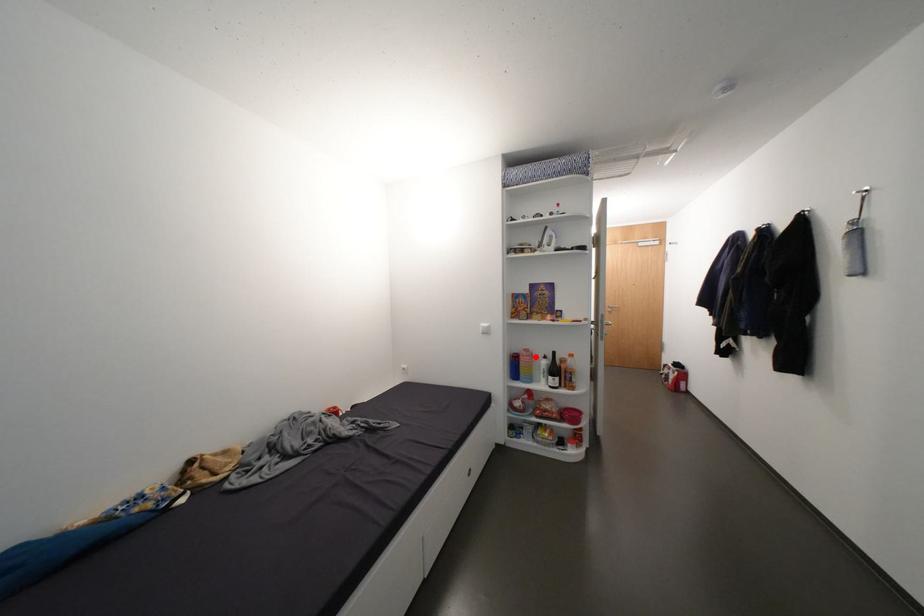
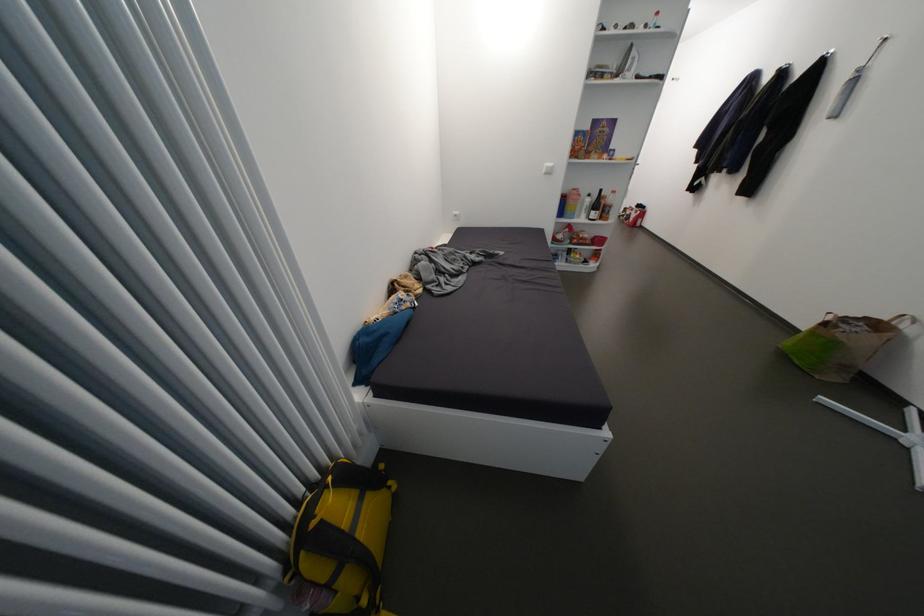
The point at the highlighted location is marked in the first image. Where is the corresponding point in the second image?

(585, 196)